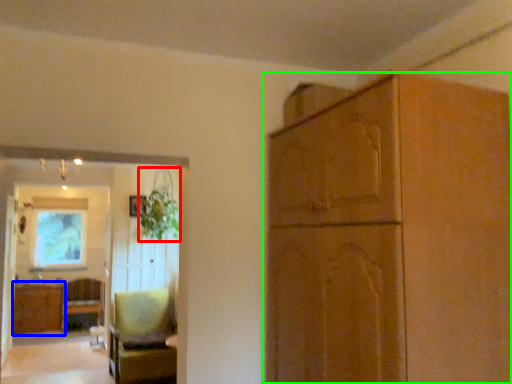
Question: Considering the real-world distances, which object is closest to plant (highlighted by a red box)? cabinetry (highlighted by a blue box) or cabinetry (highlighted by a green box).

Choices:
 (A) cabinetry
 (B) cabinetry

Answer: (A)